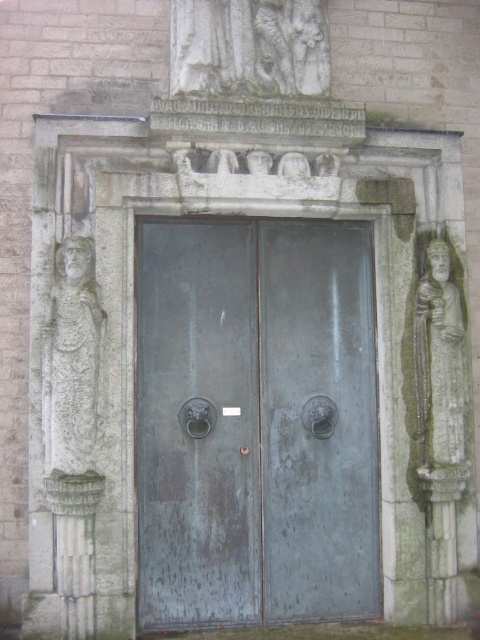
You are an architect examining the building facade. You notice two points marked on the facade. The first point is at coordinates point (51, 387) and the second at point (96, 500). Based on your observation, which point is closer to the viewer?

Point (96, 500) is closer to the viewer because the description states that point (51, 387) is behind it.

You are an architect examining the building facade. You notice two points marked on the facade. The first point is at coordinates point (336, 324) and the second is at point (432, 246). From your vantage point, which point is closer to you?

Point (432, 246) is closer to you because it is in front of point (336, 324) according to their spatial arrangement.